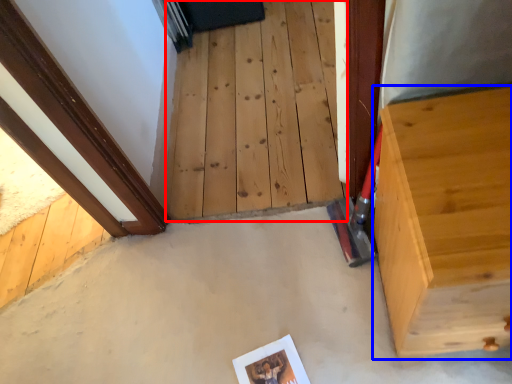
Question: Which point is closer to the camera, stairwell (highlighted by a red box) or furniture (highlighted by a blue box)?

Choices:
 (A) stairwell
 (B) furniture

Answer: (B)